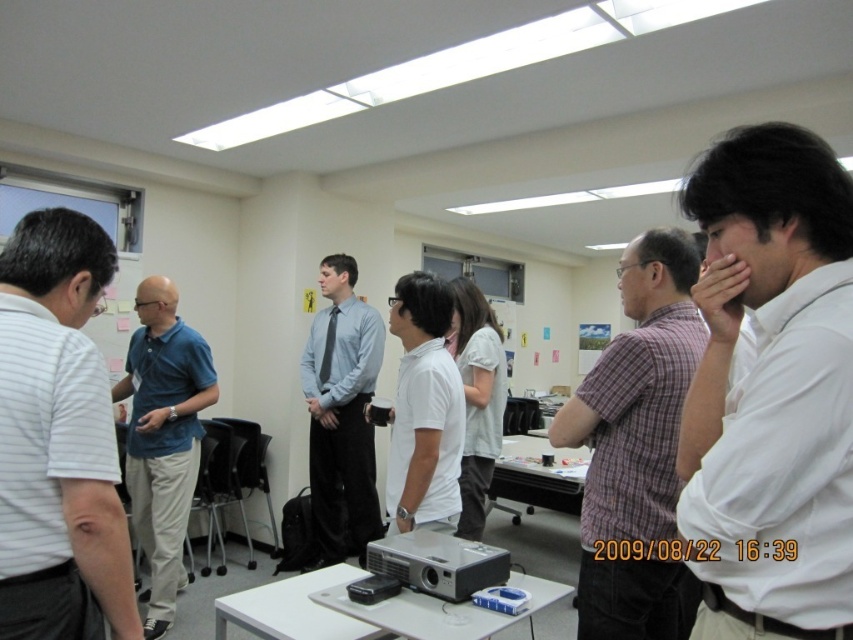
Question: Observing the image, what is the correct spatial positioning of white shirt at right in reference to light blue shirt at center?

Choices:
 (A) above
 (B) below

Answer: (A)

Question: Considering the real-world distances, which object is closest to the plaid cotton shirt at center?

Choices:
 (A) white shirt at right
 (B) light blue shirt at center
 (C) blue shirt at center
 (D) white striped shirt at left

Answer: (A)

Question: Which of the following is the closest to the observer?

Choices:
 (A) (726, 580)
 (B) (96, 508)
 (C) (646, 269)

Answer: (A)

Question: Which point appears farthest from the camera in this image?

Choices:
 (A) (160, 381)
 (B) (55, 422)
 (C) (604, 424)

Answer: (A)

Question: Is white striped shirt at left to the left of blue shirt at center from the viewer's perspective?

Choices:
 (A) yes
 (B) no

Answer: (B)

Question: In this image, where is white shirt at right located relative to light blue shirt at center?

Choices:
 (A) left
 (B) right

Answer: (B)